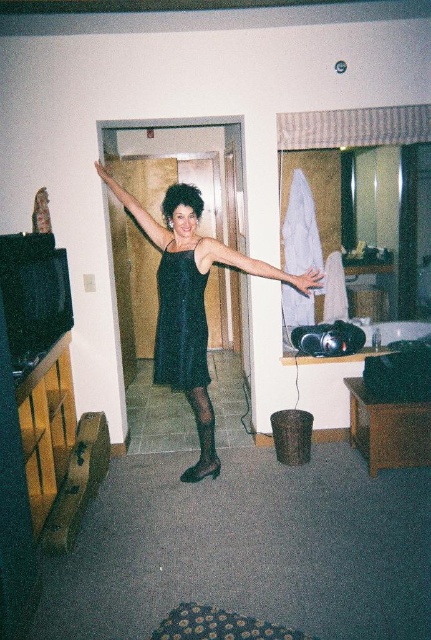
Is shiny black dress at center thinner than black satin dress at upper center?

No.

Where is `shiny black dress at center`? The width and height of the screenshot is (431, 640). shiny black dress at center is located at coordinates (190, 301).

The height and width of the screenshot is (640, 431). I want to click on shiny black dress at center, so click(x=190, y=301).

Is shiny black dress at center closer to camera compared to black satin dress at center?

No.

Does shiny black dress at center have a lesser width compared to black satin dress at center?

In fact, shiny black dress at center might be wider than black satin dress at center.

What do you see at coordinates (190, 301) in the screenshot?
I see `shiny black dress at center` at bounding box center [190, 301].

The height and width of the screenshot is (640, 431). I want to click on shiny black dress at center, so click(x=190, y=301).

Does black sequined dress at center appear on the right side of black satin dress at center?

No, black sequined dress at center is not to the right of black satin dress at center.

Can you confirm if black sequined dress at center is positioned above black satin dress at center?

Incorrect, black sequined dress at center is not positioned above black satin dress at center.

Does point (190, 275) lie in front of point (209, 248)?

No.

In order to click on black sequined dress at center in this screenshot , I will do (181, 323).